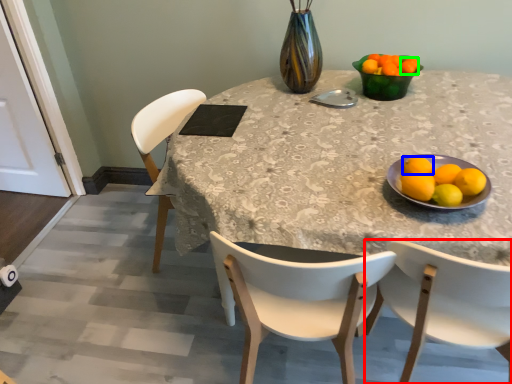
Question: Considering the real-world distances, which object is closest to chair (highlighted by a red box)? lemon (highlighted by a blue box) or tangerine (highlighted by a green box).

Choices:
 (A) lemon
 (B) tangerine

Answer: (A)